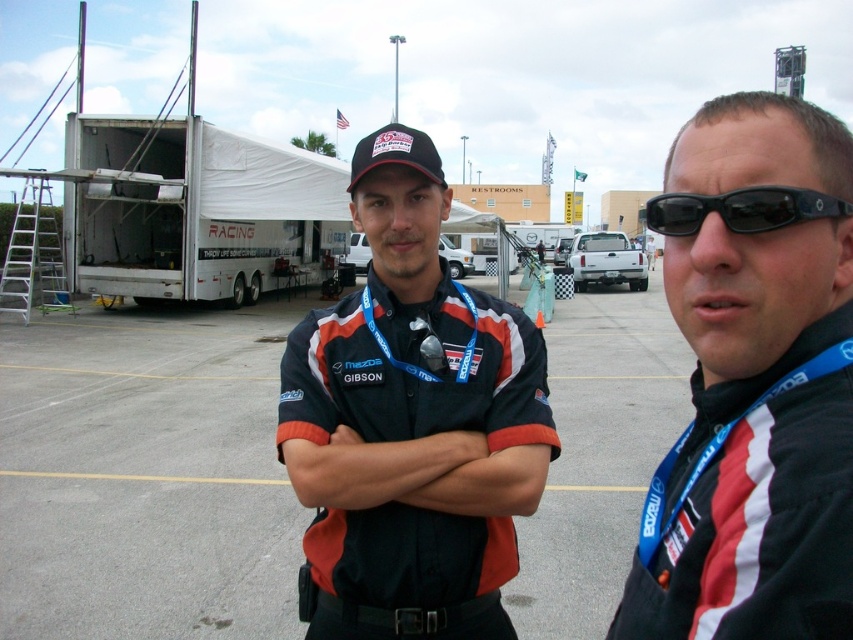
Question: Is gray asphalt parking lot at center positioned in front of matte black shirt at center?

Choices:
 (A) yes
 (B) no

Answer: (B)

Question: Which point is closer to the camera taking this photo?

Choices:
 (A) (798, 595)
 (B) (51, 506)

Answer: (A)

Question: Which of the following is the farthest from the observer?

Choices:
 (A) (770, 189)
 (B) (409, 296)

Answer: (B)

Question: Which point is farther from the camera taking this photo?

Choices:
 (A) (642, 400)
 (B) (770, 220)

Answer: (A)

Question: Does black fabric shirt at center lie behind white matte trailer truck at left?

Choices:
 (A) yes
 (B) no

Answer: (B)

Question: Is black fabric shirt at center wider than matte black shirt at center?

Choices:
 (A) yes
 (B) no

Answer: (A)